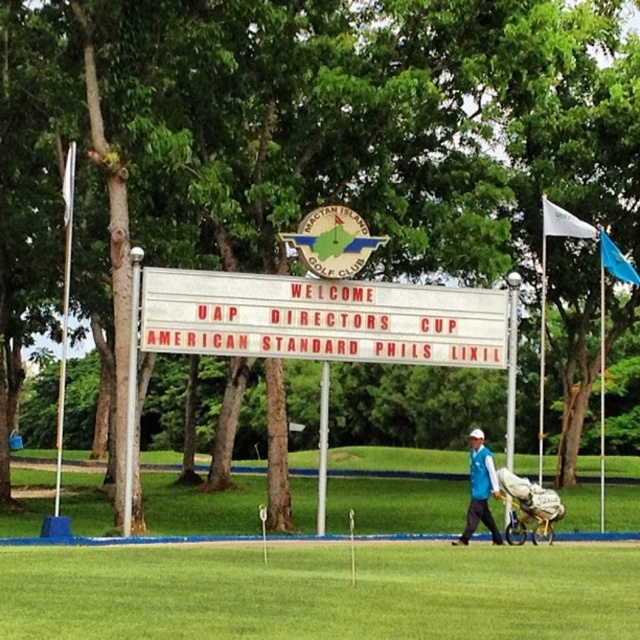
Question: Does green grass at lower center lie behind white plastic sign at center?

Choices:
 (A) yes
 (B) no

Answer: (B)

Question: Is white plastic sign at center positioned in front of blue fabric flag at upper right?

Choices:
 (A) yes
 (B) no

Answer: (A)

Question: Estimate the real-world distances between objects in this image. Which object is closer to the white fabric flag at upper right?

Choices:
 (A) metallic silver baby carriage at center
 (B) blue fabric golfer at center

Answer: (A)

Question: Based on their relative distances, which object is nearer to the metallic silver baby carriage at center?

Choices:
 (A) blue fabric flag at upper right
 (B) green grass at lower center
 (C) white plastic sign at center

Answer: (C)

Question: Is white fabric flag at upper right below blue fabric flag at upper right?

Choices:
 (A) no
 (B) yes

Answer: (A)

Question: Among these objects, which one is nearest to the camera?

Choices:
 (A) blue fabric golfer at center
 (B) white fabric flag at upper right
 (C) green grass at lower center
 (D) metallic silver baby carriage at center

Answer: (C)